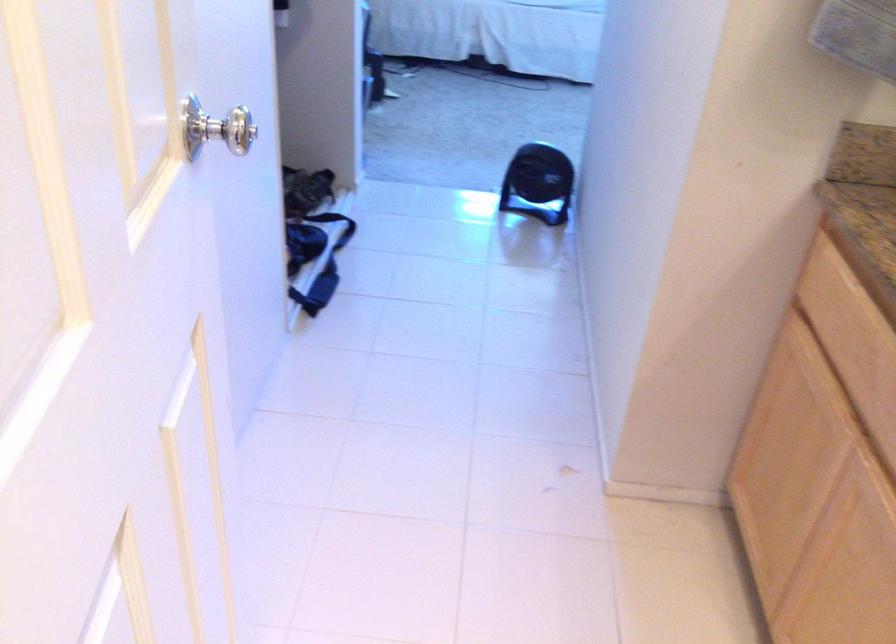
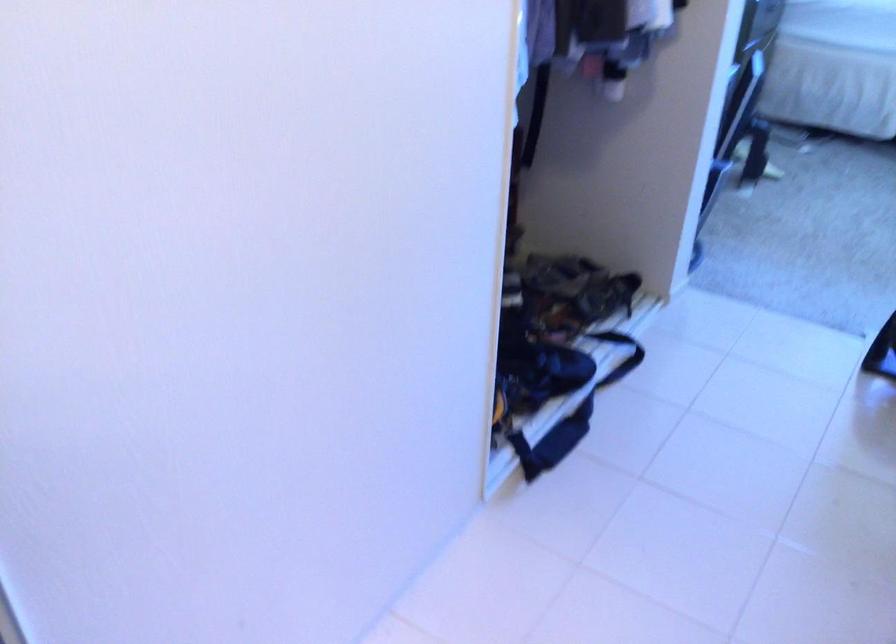
Question: Which direction would the cameraman need to move to produce the second image? Reply with the corresponding letter.

Choices:
 (A) Left
 (B) Right
 (C) Forward
 (D) Backward

Answer: (C)